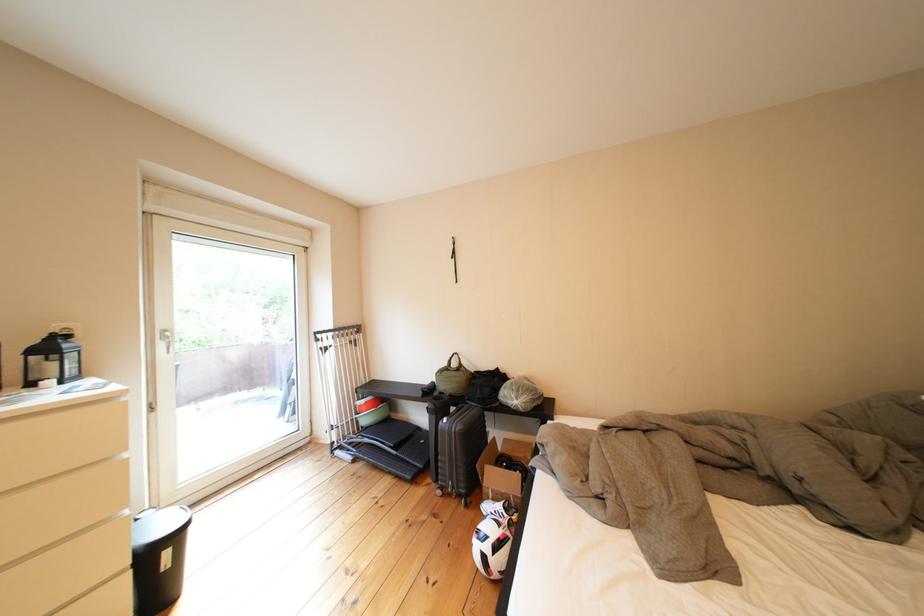
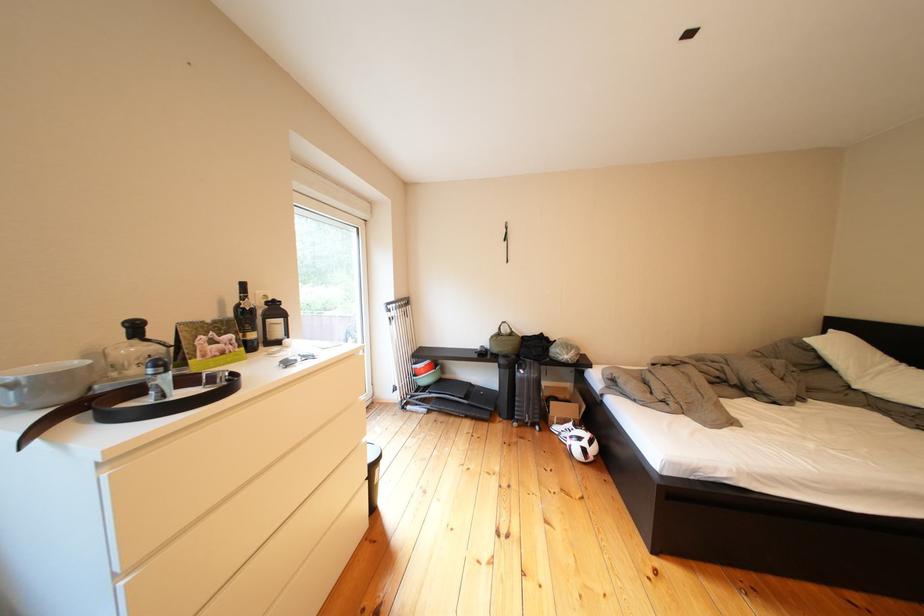
The point at (464, 366) is marked in the first image. Where is the corresponding point in the second image?

(514, 334)